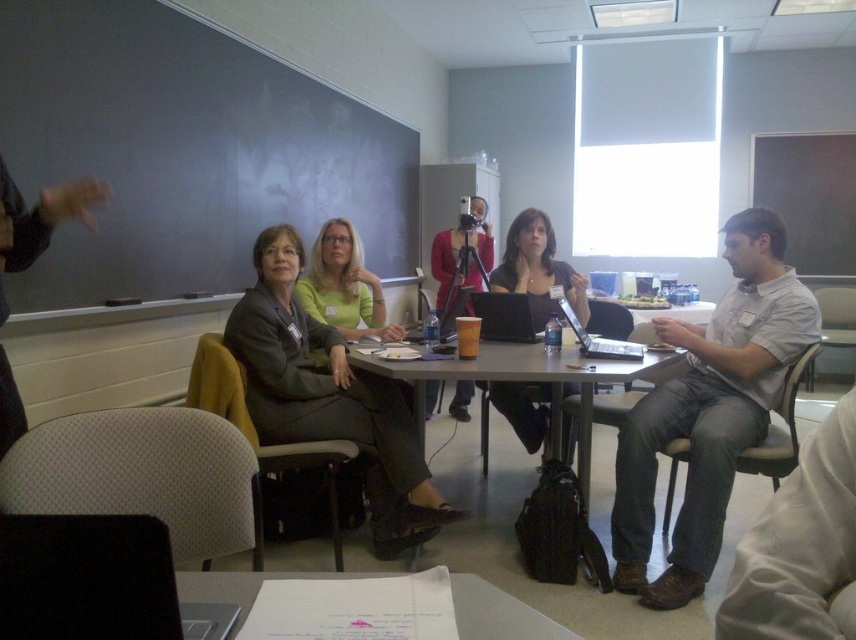
Question: Does white paper at center appear on the right side of matte green shirt at center?

Choices:
 (A) yes
 (B) no

Answer: (A)

Question: Is gray cotton shirt at right closer to the viewer compared to metallic gray table at center?

Choices:
 (A) no
 (B) yes

Answer: (A)

Question: Which of the following is the closest to the observer?

Choices:
 (A) (574, 328)
 (B) (504, 616)
 (C) (557, 452)

Answer: (B)

Question: Which point is farther to the camera?

Choices:
 (A) metallic gray table at center
 (B) matte gray suit at center

Answer: (B)

Question: Among these objects, which one is nearest to the camera?

Choices:
 (A) silver metallic laptop at center
 (B) matte black laptop at center

Answer: (A)

Question: Is gray cotton shirt at right above matte green shirt at center?

Choices:
 (A) yes
 (B) no

Answer: (B)